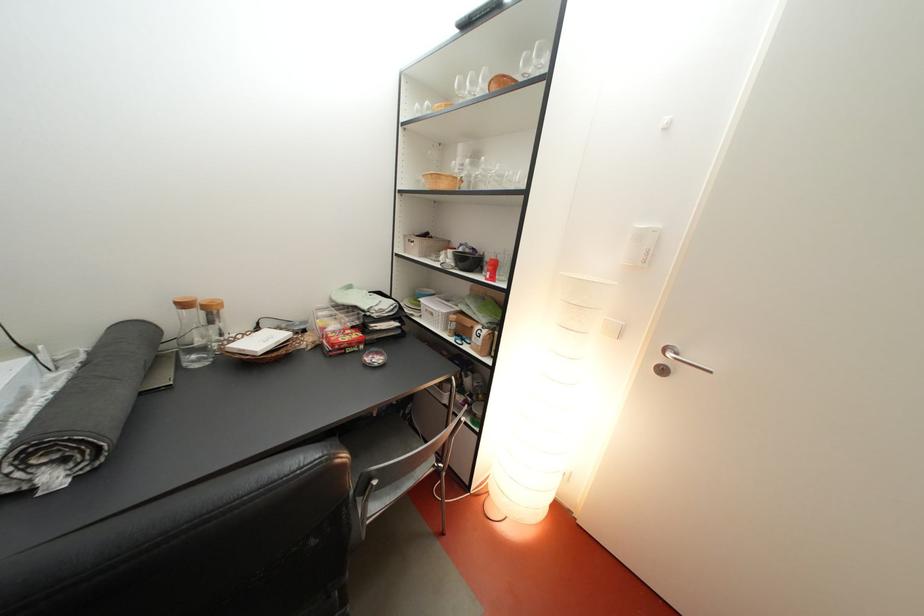
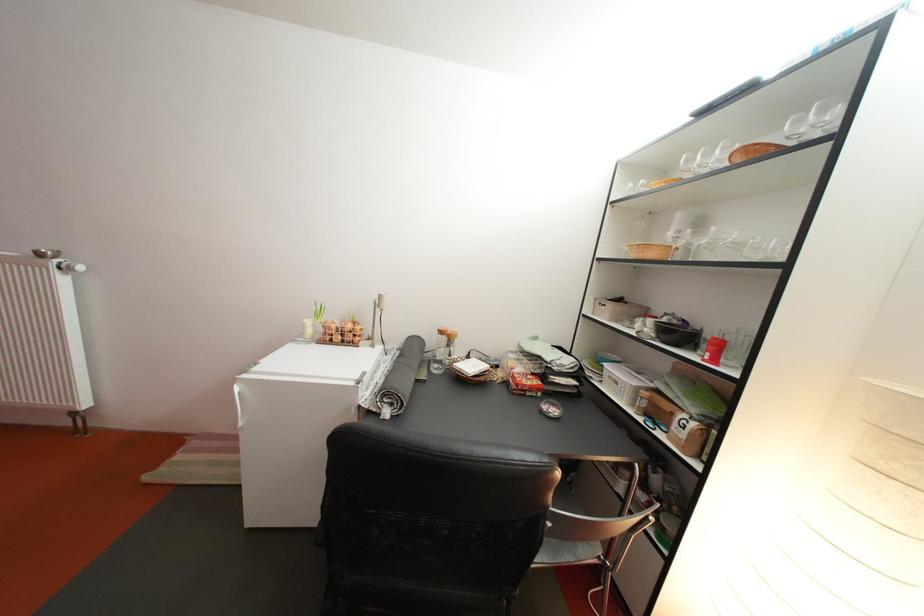
In the second image, find the point that corresponds to (x=495, y=84) in the first image.

(734, 156)